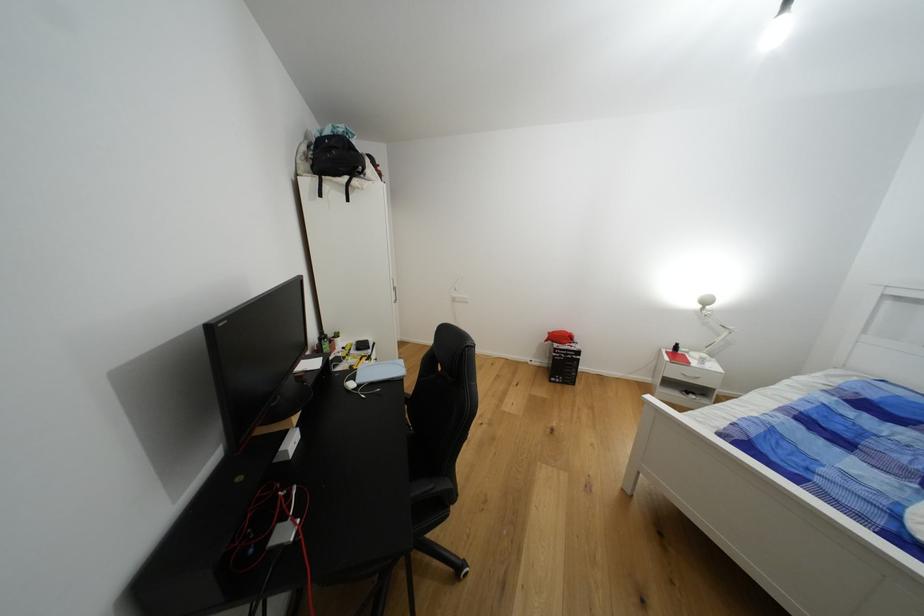
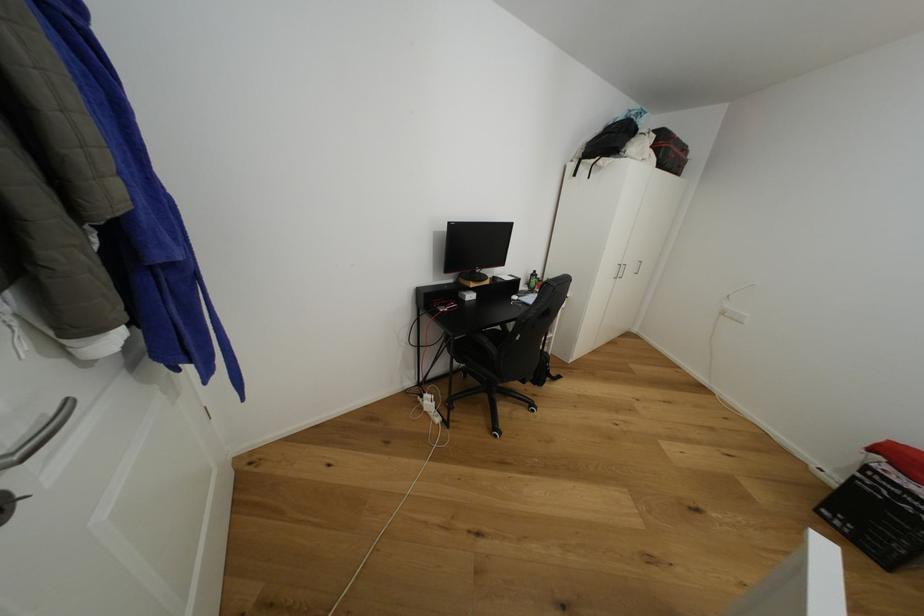
Locate, in the second image, the point that corresponds to (286,450) in the first image.

(469, 294)